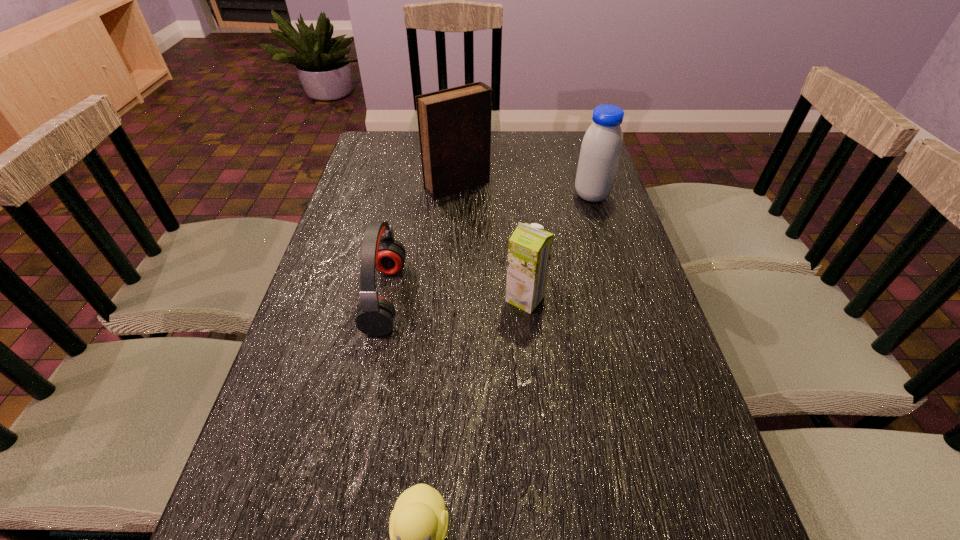
The width and height of the screenshot is (960, 540). I want to click on Bible, so click(x=454, y=124).

This screenshot has width=960, height=540. I want to click on the rightmost object, so click(601, 148).

Find the location of a particular element. The width and height of the screenshot is (960, 540). the farther soya milk is located at coordinates (601, 148).

Locate an element on the screen. This screenshot has width=960, height=540. the left soya milk is located at coordinates (529, 252).

At what (x,y) coordinates should I click in order to perform the action: click on the nearer soya milk. Please return your answer as a coordinate pair (x, y). This screenshot has width=960, height=540. Looking at the image, I should click on (529, 252).

This screenshot has height=540, width=960. In order to click on earphone in this screenshot , I will do `click(375, 317)`.

In order to click on vacant space located on the back of the Bible in this screenshot , I will do `click(461, 137)`.

In order to click on free location located 0.180m on the back of the right soya milk in this screenshot , I will do coord(580,156).

What are the coordinates of `vacant space situated 0.150m on the left of the left soya milk` in the screenshot? It's located at (443, 299).

Identify the location of free space located 0.100m on the ear cups of the earphone. (444, 298).